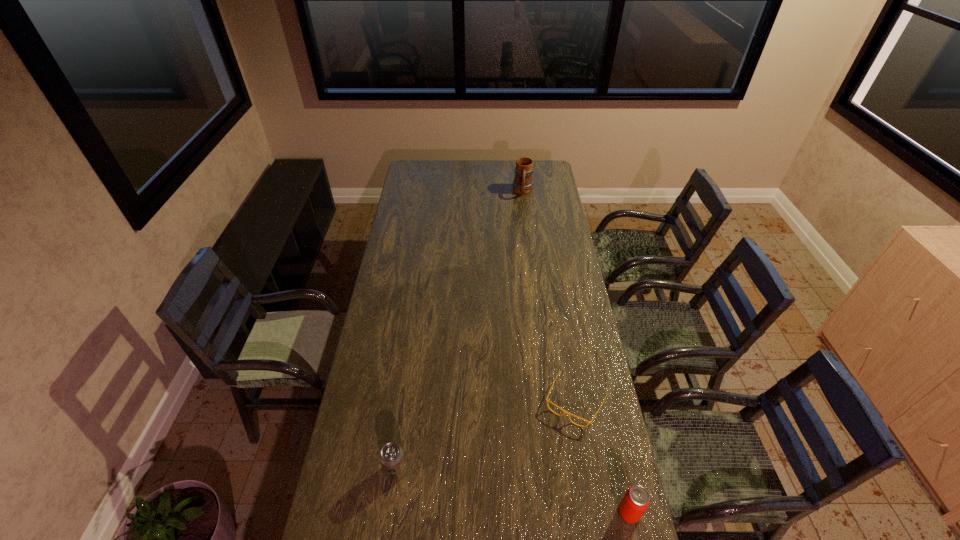
Locate an element on the screen. Image resolution: width=960 pixels, height=540 pixels. mug positioned at the right edge is located at coordinates (522, 184).

The width and height of the screenshot is (960, 540). In order to click on object present at the near right corner in this screenshot , I will do `click(636, 500)`.

Where is `free space at the far edge`? The width and height of the screenshot is (960, 540). free space at the far edge is located at coordinates (460, 166).

I want to click on vacant space at the left edge of the desktop, so pyautogui.click(x=406, y=190).

Locate an element on the screen. vacant position at the right edge of the desktop is located at coordinates (541, 241).

What are the coordinates of `vacant space at the far left corner of the desktop` in the screenshot? It's located at (432, 168).

The image size is (960, 540). Identify the location of empty location between the third farthest object and the spectacles. (486, 436).

Identify the location of free space between the nearer beer can and the third nearest object. The width and height of the screenshot is (960, 540). (602, 457).

Identify the location of free spot between the shortest object and the leftmost object. This screenshot has height=540, width=960. (486, 436).

Find the location of a particular element. This screenshot has width=960, height=540. blank region between the shortest object and the right beer can is located at coordinates (602, 457).